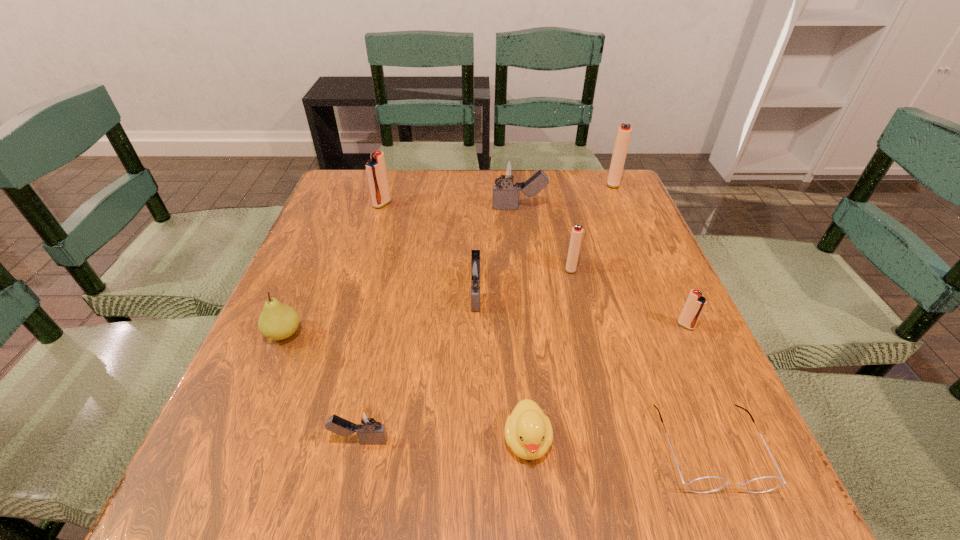
Identify the location of the farthest igniter. The image size is (960, 540). (624, 132).

The width and height of the screenshot is (960, 540). In order to click on the biggest red igniter in this screenshot , I will do `click(624, 132)`.

I want to click on the second biggest red igniter, so click(x=376, y=169).

Image resolution: width=960 pixels, height=540 pixels. What are the coordinates of `the leftmost igniter` in the screenshot? It's located at (376, 169).

Identify the location of the biggest gray igniter. This screenshot has width=960, height=540. [x=506, y=171].

Identify the location of the rightmost gray igniter. (506, 171).

I want to click on the second farthest gray igniter, so click(x=474, y=270).

Where is `the second smallest gray igniter`? the second smallest gray igniter is located at coordinates (474, 270).

I want to click on the fourth farthest igniter, so click(x=577, y=231).

Find the location of a particular element. The height and width of the screenshot is (540, 960). the fifth igniter from left to right is located at coordinates (577, 231).